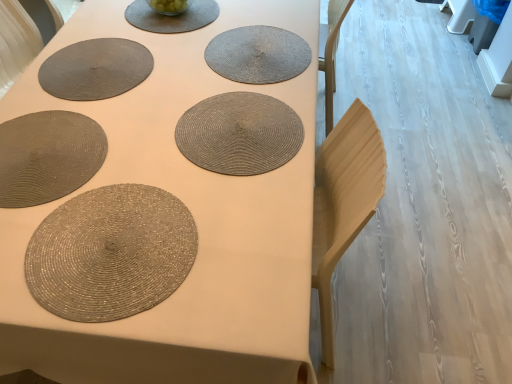
Where is `vacant space that's between rattan placemat at center, which appears as the first coaster when viewed from the back, and matte gray placemat at upper left, arranged as the 3th paper plate when ordered from the bottom`? vacant space that's between rattan placemat at center, which appears as the first coaster when viewed from the back, and matte gray placemat at upper left, arranged as the 3th paper plate when ordered from the bottom is located at coordinates (173, 56).